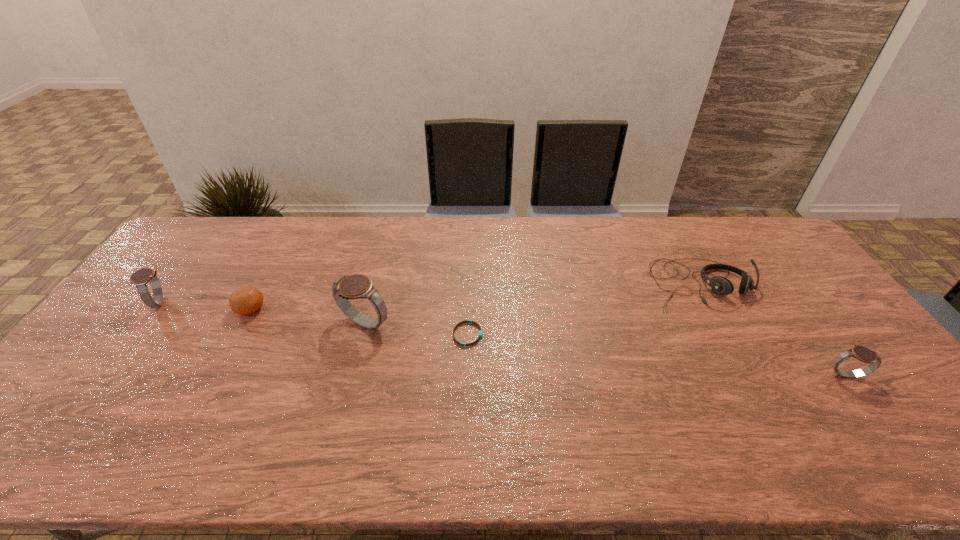
Find the location of `vacant space located on the back of the leftmost watch`. vacant space located on the back of the leftmost watch is located at coordinates [181, 273].

Where is `vacant space located on the back of the tallest watch`? The image size is (960, 540). vacant space located on the back of the tallest watch is located at coordinates coord(375,285).

Identify the location of blank area located on the left of the nearest object. This screenshot has width=960, height=540. (752, 374).

The height and width of the screenshot is (540, 960). In order to click on vacant space located 0.240m on the outer surface of the headset in this screenshot , I will do `click(754, 386)`.

Identify the location of free space located on the buckle of the fourth object from left to right. (508, 334).

Identify the location of blank area located on the left of the clementine. tap(175, 309).

At what (x,y) coordinates should I click in order to perform the action: click on object that is at the left edge. Please return your answer as a coordinate pair (x, y). This screenshot has width=960, height=540. Looking at the image, I should click on (140, 278).

Locate an element on the screen. object positioned at the right edge is located at coordinates (861, 353).

At what (x,y) coordinates should I click in order to perform the action: click on free space at the far edge. Please return your answer as a coordinate pair (x, y). Looking at the image, I should click on (463, 218).

Locate an element on the screen. Image resolution: width=960 pixels, height=540 pixels. vacant region at the near edge of the desktop is located at coordinates (310, 402).